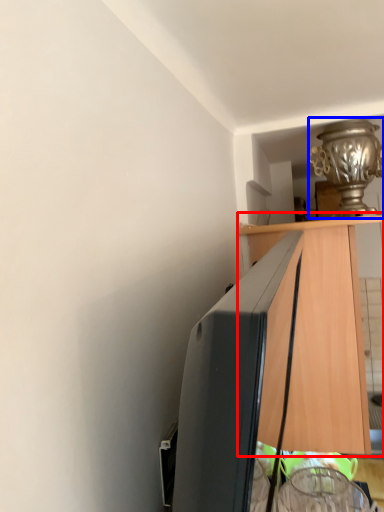
Question: Which point is closer to the camera, cabinetry (highlighted by a red box) or lamp (highlighted by a blue box)?

Choices:
 (A) cabinetry
 (B) lamp

Answer: (A)